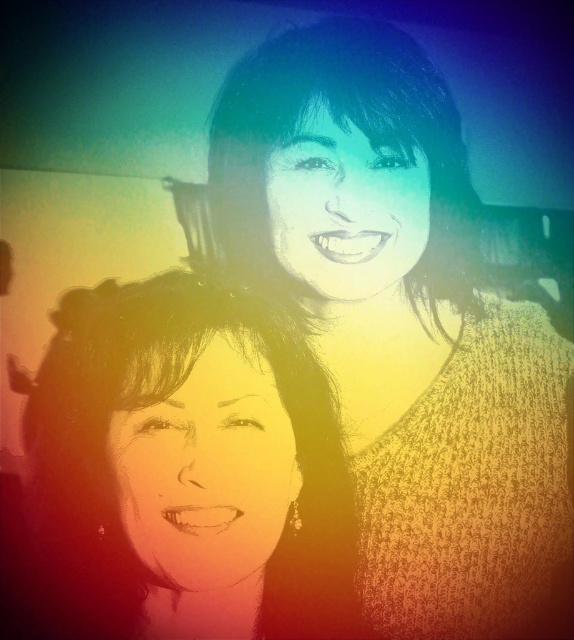
Question: Which point appears closest to the camera in this image?

Choices:
 (A) (416, 72)
 (B) (129, 584)

Answer: (B)

Question: Which point is closer to the camera?

Choices:
 (A) (215, 214)
 (B) (317, 362)
 (C) (304, 241)

Answer: (B)

Question: Does smooth black hair at upper center have a greater width compared to smooth skin face at upper center?

Choices:
 (A) no
 (B) yes

Answer: (B)

Question: Is matte yellow face at center thinner than smooth skin face at upper center?

Choices:
 (A) yes
 (B) no

Answer: (A)

Question: Is smooth black hair at upper center thinner than smooth skin face at upper center?

Choices:
 (A) no
 (B) yes

Answer: (A)

Question: Based on their relative distances, which object is farther from the smooth skin face at upper center?

Choices:
 (A) smooth black hair at upper center
 (B) smooth skin face at center
 (C) matte yellow face at center
 (D) knitted sweater at upper right

Answer: (C)